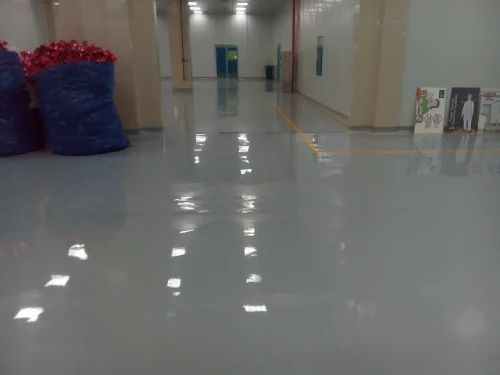
You are a GUI agent. You are given a task and a screenshot of the screen. Output one action in this format:
    pyautogui.click(x=<x>, y=<y>)
    Task: Click on the picture frames
    The width and height of the screenshot is (500, 375).
    Given the screenshot: What is the action you would take?
    pyautogui.click(x=464, y=114), pyautogui.click(x=438, y=113), pyautogui.click(x=497, y=108)